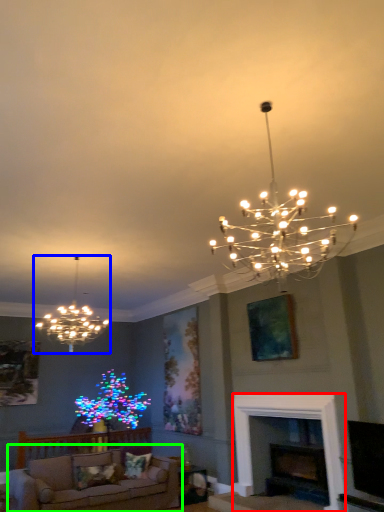
Question: Which object is the farthest from fireplace (highlighted by a red box)? Choose among these: lamp (highlighted by a blue box) or studio couch (highlighted by a green box).

Choices:
 (A) lamp
 (B) studio couch

Answer: (A)